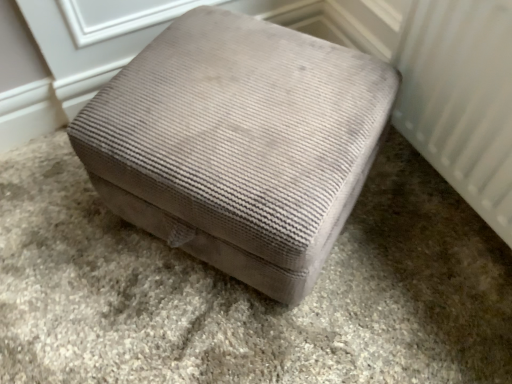
Question: Does white textured radiator at right have a greater width compared to velvet ottoman at center?

Choices:
 (A) yes
 (B) no

Answer: (B)

Question: Can you confirm if white textured radiator at right is positioned to the left of velvet ottoman at center?

Choices:
 (A) no
 (B) yes

Answer: (A)

Question: Is white textured radiator at right bigger than velvet ottoman at center?

Choices:
 (A) yes
 (B) no

Answer: (B)

Question: Does white textured radiator at right come behind velvet ottoman at center?

Choices:
 (A) no
 (B) yes

Answer: (A)

Question: Is white textured radiator at right to the right of velvet ottoman at center from the viewer's perspective?

Choices:
 (A) yes
 (B) no

Answer: (A)

Question: From the image's perspective, is white textured radiator at right beneath velvet ottoman at center?

Choices:
 (A) yes
 (B) no

Answer: (B)

Question: From the image's perspective, is beige textured ottoman at center on velvet ottoman at center?

Choices:
 (A) no
 (B) yes

Answer: (B)

Question: Is beige textured ottoman at center far from velvet ottoman at center?

Choices:
 (A) no
 (B) yes

Answer: (A)

Question: Can you confirm if beige textured ottoman at center is bigger than velvet ottoman at center?

Choices:
 (A) no
 (B) yes

Answer: (A)

Question: From the image's perspective, is beige textured ottoman at center below velvet ottoman at center?

Choices:
 (A) no
 (B) yes

Answer: (A)

Question: Is velvet ottoman at center located within beige textured ottoman at center?

Choices:
 (A) yes
 (B) no

Answer: (B)

Question: Is beige textured ottoman at center further to camera compared to velvet ottoman at center?

Choices:
 (A) no
 (B) yes

Answer: (B)

Question: Considering the relative sizes of velvet ottoman at center and velvet ottoman at center in the image provided, is velvet ottoman at center smaller than velvet ottoman at center?

Choices:
 (A) no
 (B) yes

Answer: (A)